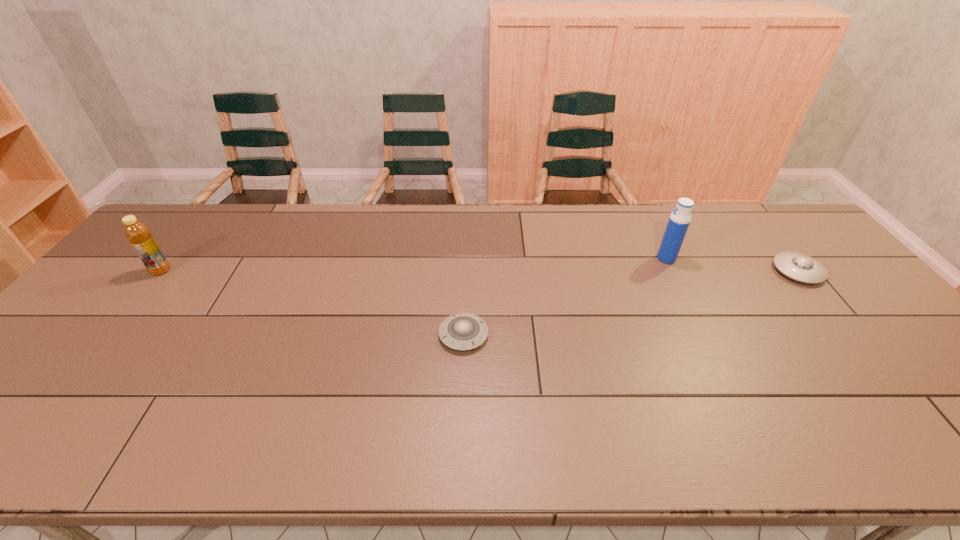
What are the coordinates of `water bottle` in the screenshot? It's located at (679, 220).

Where is `bottle`? Image resolution: width=960 pixels, height=540 pixels. bottle is located at coordinates (137, 233).

The height and width of the screenshot is (540, 960). In order to click on the second shortest object in this screenshot , I will do `click(800, 267)`.

Find the location of a particular element. the right saucer is located at coordinates (800, 267).

Where is `the nearest object`? This screenshot has height=540, width=960. the nearest object is located at coordinates (463, 331).

Image resolution: width=960 pixels, height=540 pixels. I want to click on the nearer saucer, so click(463, 331).

Identify the location of vacant space situated 0.160m on the front of the water bottle. (687, 301).

At what (x,y) coordinates should I click in order to perform the action: click on free region located on the back of the leftmost object. Please return your answer as a coordinate pair (x, y). This screenshot has height=540, width=960. Looking at the image, I should click on (199, 225).

Identify the location of free space located on the front of the second shortest object. The image size is (960, 540). (843, 326).

You are a GUI agent. You are given a task and a screenshot of the screen. Output one action in this format:
    pyautogui.click(x=<x>, y=<y>)
    Task: Click on the free space located 0.280m on the back of the nearer saucer
    This screenshot has height=540, width=960.
    Given the screenshot: What is the action you would take?
    pyautogui.click(x=467, y=251)